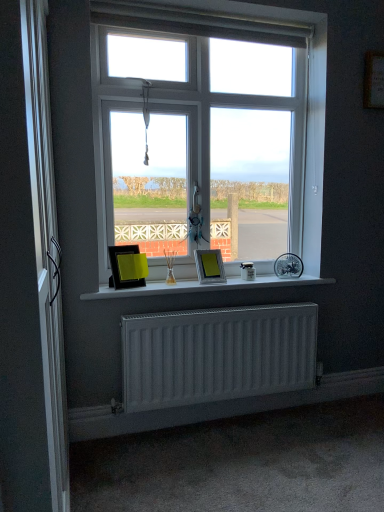
Question: Considering the positions of silver metallic screen door at left and metallic silver picture frame at center, the second picture frame viewed from the left, in the image, is silver metallic screen door at left bigger or smaller than metallic silver picture frame at center, the second picture frame viewed from the left,?

Choices:
 (A) big
 (B) small

Answer: (A)

Question: Is point (29, 147) positioned closer to the camera than point (210, 267)?

Choices:
 (A) closer
 (B) farther

Answer: (A)

Question: Which object is positioned farthest from the matte black picture frame at center, marked as the second picture frame in a right-to-left arrangement?

Choices:
 (A) silver metallic screen door at left
 (B) white matte radiator at lower center
 (C) white matte window sill at center
 (D) metallic silver picture frame at center, the second picture frame viewed from the left
 (E) white plastic window at center

Answer: (A)

Question: Considering the real-world distances, which object is farthest from the white matte radiator at lower center?

Choices:
 (A) white plastic window at center
 (B) metallic silver picture frame at center, the second picture frame viewed from the left
 (C) silver metallic screen door at left
 (D) matte black picture frame at center, marked as the second picture frame in a right-to-left arrangement
 (E) white matte window sill at center

Answer: (C)